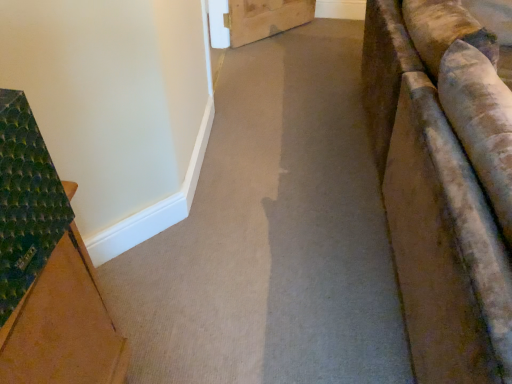
The width and height of the screenshot is (512, 384). In order to click on carpet at center in this screenshot , I will do `click(273, 235)`.

The image size is (512, 384). Describe the element at coordinates (273, 235) in the screenshot. I see `carpet at center` at that location.

The image size is (512, 384). I want to click on green textured mat at left, so click(x=46, y=270).

Image resolution: width=512 pixels, height=384 pixels. Describe the element at coordinates (46, 270) in the screenshot. I see `green textured mat at left` at that location.

At what (x,y) coordinates should I click in order to perform the action: click on carpet at center. Please return your answer as a coordinate pair (x, y). The height and width of the screenshot is (384, 512). Looking at the image, I should click on (273, 235).

Considering the relative positions of green textured mat at left and carpet at center in the image provided, is green textured mat at left to the left or to the right of carpet at center?

From the image, it's evident that green textured mat at left is to the left of carpet at center.

Relative to carpet at center, is green textured mat at left in front or behind?

green textured mat at left is in front of carpet at center.

Is point (86, 360) more distant than point (129, 311)?

No, it is in front of (129, 311).

From the image's perspective, does green textured mat at left appear higher than carpet at center?

Actually, green textured mat at left appears below carpet at center in the image.

From a real-world perspective, is green textured mat at left located higher than carpet at center?

Indeed, from a real-world perspective, green textured mat at left stands above carpet at center.

Between green textured mat at left and carpet at center, which one has larger width?

carpet at center.

In terms of height, does green textured mat at left look taller or shorter compared to carpet at center?

Clearly, green textured mat at left is taller compared to carpet at center.

In terms of size, does green textured mat at left appear bigger or smaller than carpet at center?

In the image, green textured mat at left appears to be smaller than carpet at center.

Is carpet at center a part of green textured mat at left?

That's incorrect, carpet at center is not inside green textured mat at left.

Consider the image. Is green textured mat at left in contact with carpet at center?

No, green textured mat at left is not touching carpet at center.

Is green textured mat at left looking in the opposite direction of carpet at center?

No, carpet at center is not at the back of green textured mat at left.

What's the angular difference between green textured mat at left and carpet at center's facing directions?

The angular difference between green textured mat at left and carpet at center is 174 degrees.

The image size is (512, 384). Find the location of `path below the green textured mat at left (from a real-world perspective)`. path below the green textured mat at left (from a real-world perspective) is located at coordinates (273, 235).

Between carpet at center and green textured mat at left, which one appears on the right side from the viewer's perspective?

From the viewer's perspective, carpet at center appears more on the right side.

Between carpet at center and green textured mat at left, which one is positioned in front?

green textured mat at left is in front.

Is point (249, 325) farther from camera compared to point (89, 321)?

Yes, point (249, 325) is behind point (89, 321).

From the image's perspective, which is below, carpet at center or green textured mat at left?

From the image's view, green textured mat at left is below.

From a real-world perspective, is carpet at center positioned over green textured mat at left based on gravity?

No.

Is carpet at center wider or thinner than green textured mat at left?

In the image, carpet at center appears to be wider than green textured mat at left.

From their relative heights in the image, would you say carpet at center is taller or shorter than green textured mat at left?

In the image, carpet at center appears to be shorter than green textured mat at left.

Does carpet at center have a larger size compared to green textured mat at left?

Yes, carpet at center is bigger than green textured mat at left.

Can we say carpet at center lies outside green textured mat at left?

Yes, carpet at center is located beyond the bounds of green textured mat at left.

Would you say carpet at center is a long distance from green textured mat at left?

Actually, carpet at center and green textured mat at left are a little close together.

Is carpet at center turned away from green textured mat at left?

No, green textured mat at left is not at the back of carpet at center.

How different are the orientations of carpet at center and green textured mat at left in degrees?

174 degrees separate the facing orientations of carpet at center and green textured mat at left.

At what (x,y) coordinates should I click in order to perform the action: click on furniture above the carpet at center (from a real-world perspective). Please return your answer as a coordinate pair (x, y). This screenshot has width=512, height=384. Looking at the image, I should click on (46, 270).

This screenshot has width=512, height=384. What are the coordinates of `furniture above the carpet at center (from a real-world perspective)` in the screenshot? It's located at (46, 270).

I want to click on path that is on the right side of green textured mat at left, so click(x=273, y=235).